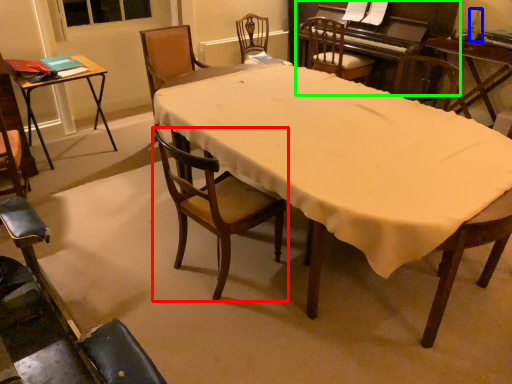
Question: Estimate the real-world distances between objects in this image. Which object is farther from chair (highlighted by a red box), bottle (highlighted by a blue box) or piano (highlighted by a green box)?

Choices:
 (A) bottle
 (B) piano

Answer: (A)